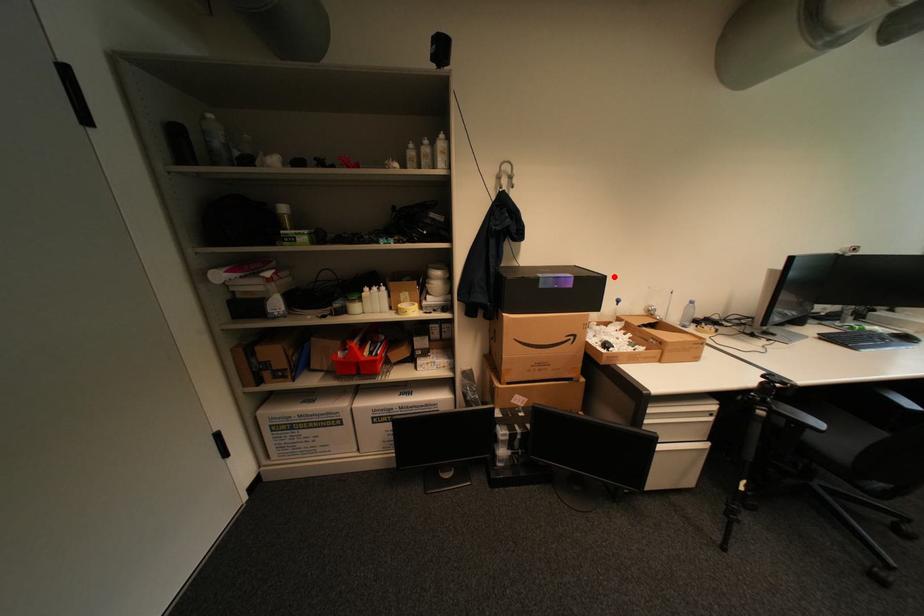
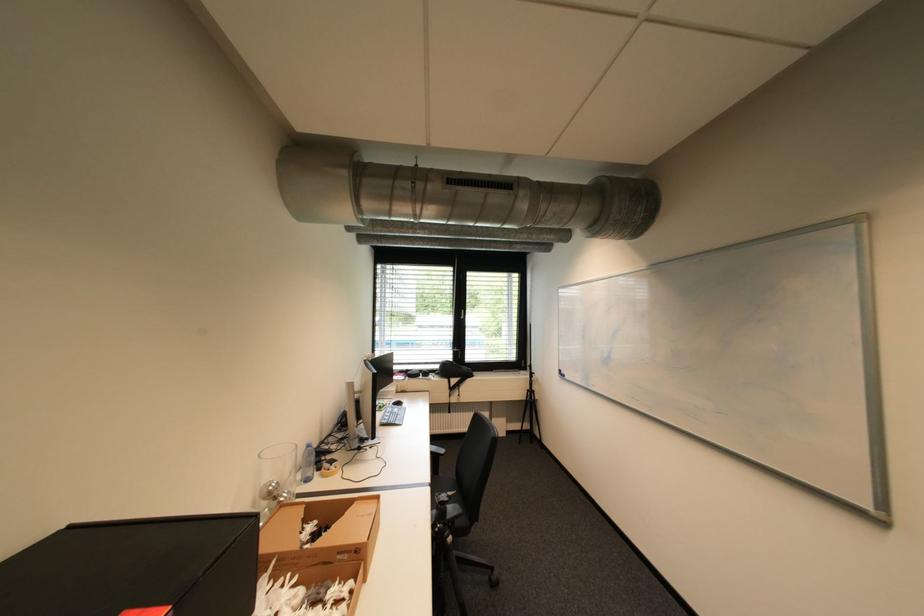
Question: A red point is marked in image1. In image2, is the corresponding 3D point closer to the camera or farther? Reply with the corresponding letter.

Choices:
 (A) The corresponding 3D point is closer.
 (B) The corresponding 3D point is farther.

Answer: (A)